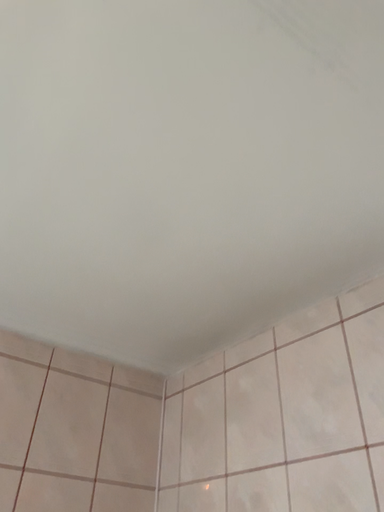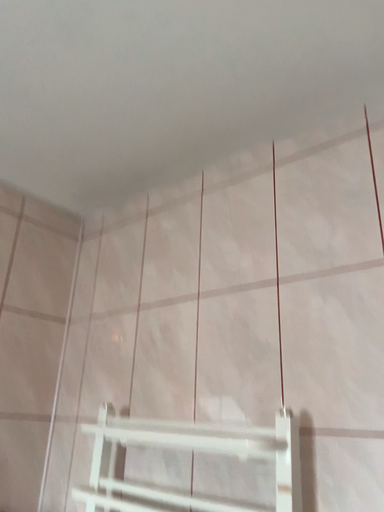
Question: How did the camera likely rotate when shooting the video?

Choices:
 (A) rotated downward
 (B) rotated upward

Answer: (A)